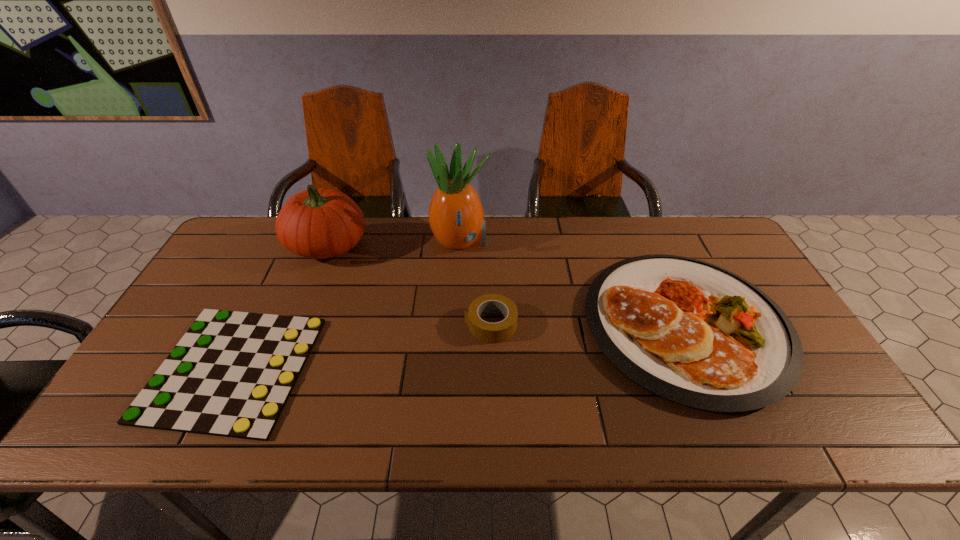
Image resolution: width=960 pixels, height=540 pixels. In order to click on vacant region located at the edge of the duct tape in this screenshot , I will do `click(354, 324)`.

Where is `vacant area located at the edge of the duct tape`? The width and height of the screenshot is (960, 540). vacant area located at the edge of the duct tape is located at coordinates (435, 324).

Locate an element on the screen. The width and height of the screenshot is (960, 540). vacant space located 0.390m on the right of the checkerboard is located at coordinates (468, 368).

You are a GUI agent. You are given a task and a screenshot of the screen. Output one action in this format:
    pyautogui.click(x=<x>, y=<y>)
    Task: Click on the pineapple that is at the far edge
    The height and width of the screenshot is (540, 960).
    Given the screenshot: What is the action you would take?
    pyautogui.click(x=456, y=217)

Where is `pumpkin that is at the far edge`? The width and height of the screenshot is (960, 540). pumpkin that is at the far edge is located at coordinates (318, 223).

Locate an element on the screen. The height and width of the screenshot is (540, 960). dish that is at the far edge is located at coordinates (693, 333).

Locate an element on the screen. This screenshot has width=960, height=540. dish present at the near edge is located at coordinates (693, 333).

Image resolution: width=960 pixels, height=540 pixels. In order to click on checkerboard situated at the near edge in this screenshot , I will do `click(231, 374)`.

The height and width of the screenshot is (540, 960). In order to click on object at the left edge in this screenshot , I will do tap(231, 374).

What are the coordinates of `object that is at the right edge` in the screenshot? It's located at [693, 333].